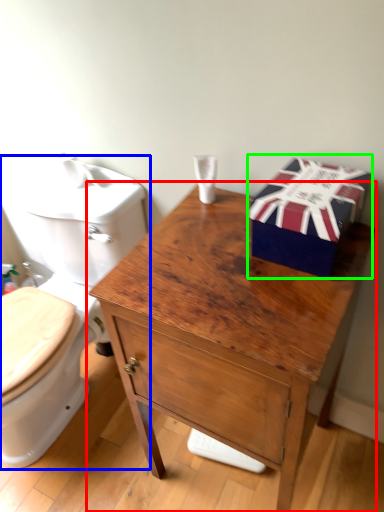
Question: Which object is the farthest from table (highlighted by a red box)? Choose among these: toilet (highlighted by a blue box) or gift box (highlighted by a green box).

Choices:
 (A) toilet
 (B) gift box

Answer: (A)